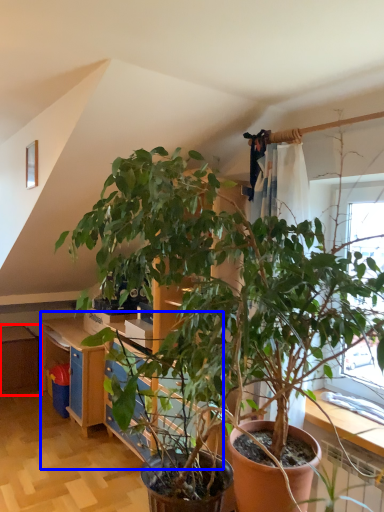
Question: Which object is further to the camera taking this photo, dresser (highlighted by a red box) or dresser (highlighted by a blue box)?

Choices:
 (A) dresser
 (B) dresser

Answer: (A)